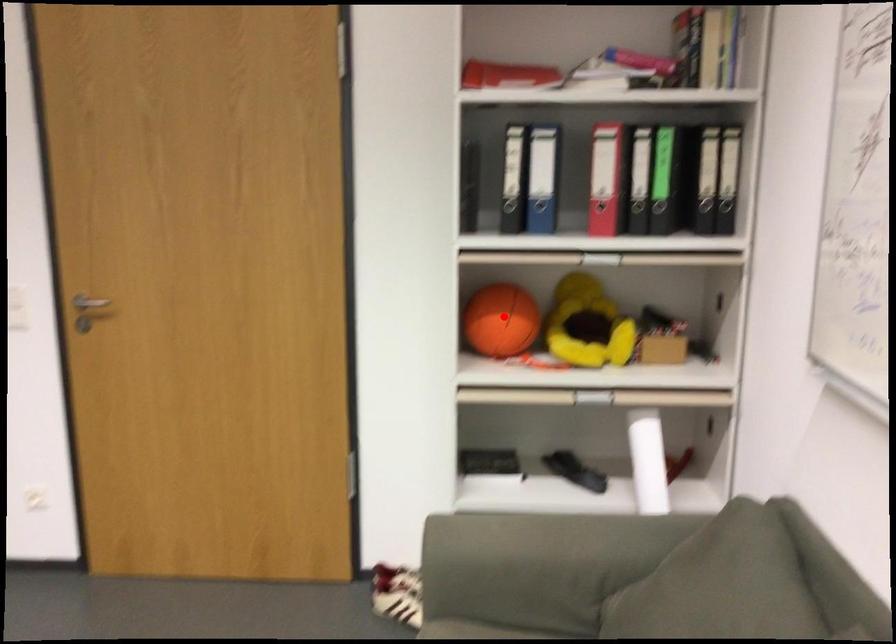
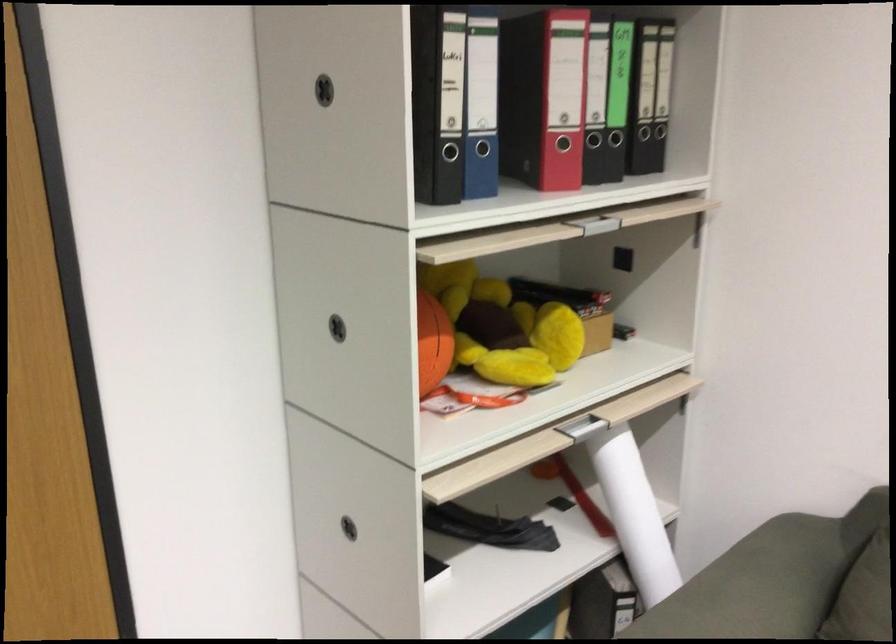
Question: I am providing you with two images of the same scene from different viewpoints. Given a red point in image1, look at the same physical point in image2. Is it:

Choices:
 (A) Closer to the viewpoint
 (B) Farther from the viewpoint

Answer: (A)